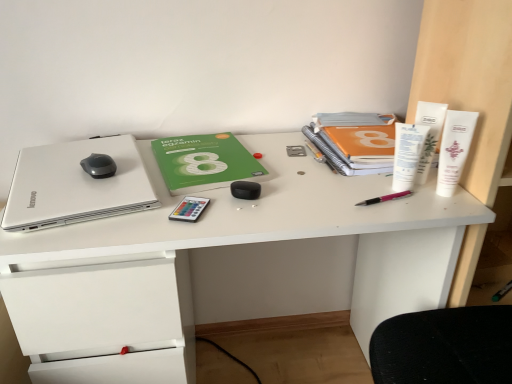
I want to click on free space that is in between white matte laptop at left and green matte paperback book at center, which appears as the 1th paperback book when viewed from the left, so click(162, 178).